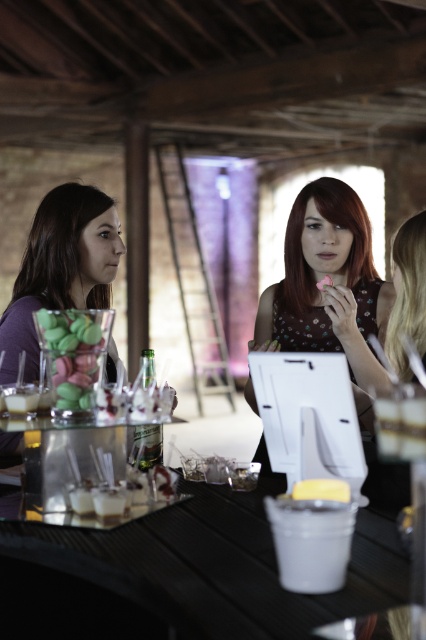
Measure the distance between matte glass jar at center and yellow matte cake at center.

They are 21.36 inches apart.

Is matte glass jar at center below yellow matte cake at center?

Actually, matte glass jar at center is above yellow matte cake at center.

Is point (37, 332) farther from viewer compared to point (331, 484)?

Yes, point (37, 332) is farther from viewer.

Identify the location of matte glass jar at center. (74, 355).

Is matte floral dress at center smaller than matte glass jar at center?

No, matte floral dress at center is not smaller than matte glass jar at center.

Describe the element at coordinates (331, 285) in the screenshot. Image resolution: width=426 pixels, height=640 pixels. I see `matte floral dress at center` at that location.

Is point (342, 220) closer to viewer compared to point (92, 397)?

No, (342, 220) is further to viewer.

Identify the location of matte floral dress at center. (331, 285).

Does matte purple shirt at left have a larger size compared to matte glass jar at center?

Correct, matte purple shirt at left is larger in size than matte glass jar at center.

Who is more forward, (49,280) or (97,378)?

Point (97,378) is in front.

Which is in front, point (9, 342) or point (95, 378)?

Point (95, 378) is more forward.

What are the coordinates of `matte purple shirt at left` in the screenshot? It's located at (60, 268).